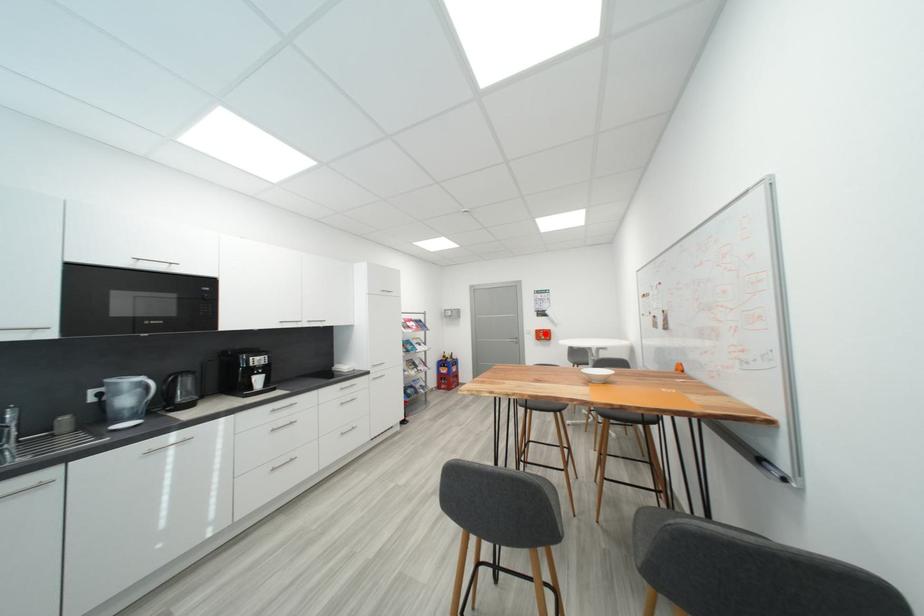
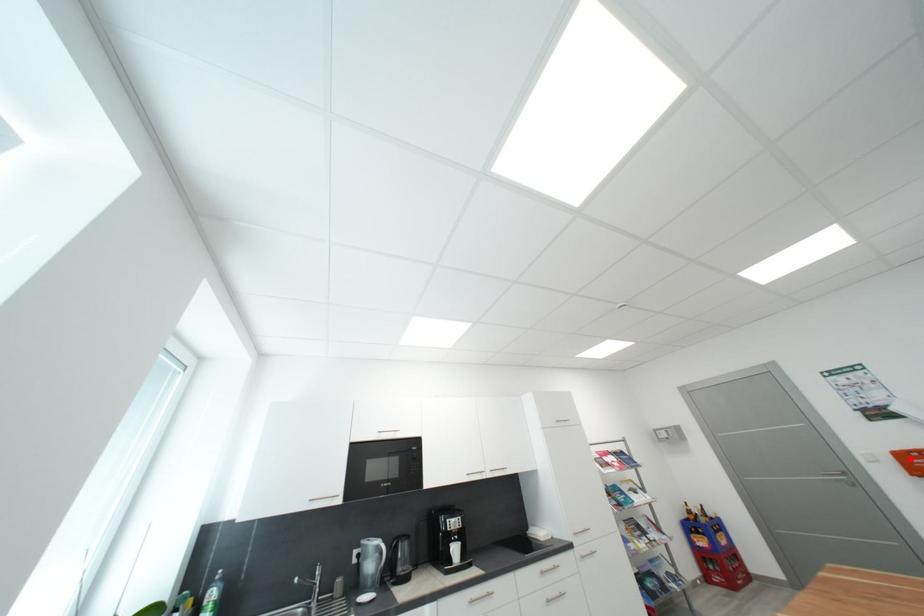
I am providing you with two images of the same scene from different viewpoints. A red point is marked on the first image and another point is marked on the second image. Are the points marked in image1 and image2 representing the same 3D position?

Yes